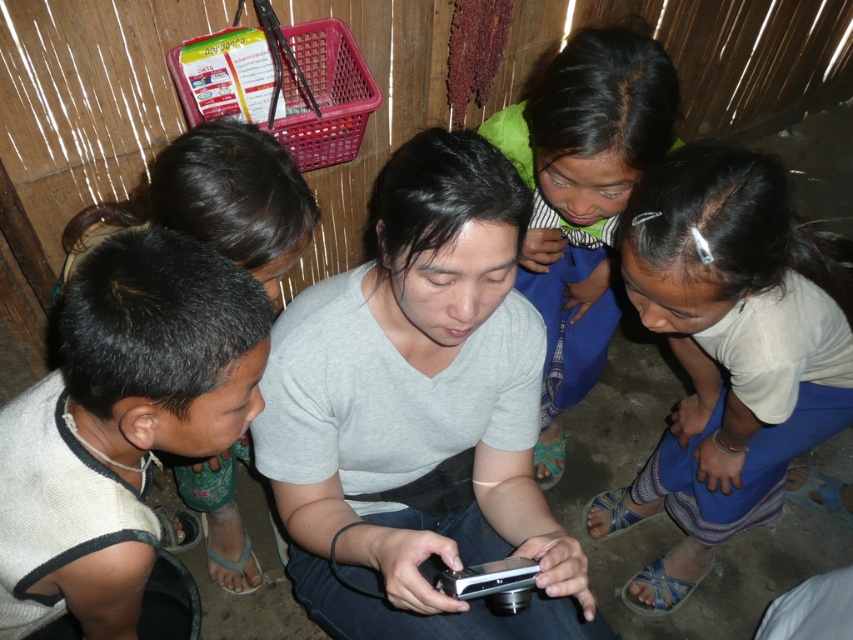
Between green fabric shirt at upper center and silver metallic smartphone at center, which one has less height?

With less height is silver metallic smartphone at center.

Is green fabric shirt at upper center bigger than silver metallic smartphone at center?

Yes.

Identify the location of green fabric shirt at upper center. (582, 198).

Does point (125, 209) come behind point (477, 595)?

Yes, it is.

The width and height of the screenshot is (853, 640). What do you see at coordinates (213, 202) in the screenshot?
I see `gray matte shirt at center` at bounding box center [213, 202].

Is point (253, 211) positioned after point (456, 577)?

Yes, point (253, 211) is farther from viewer.

Where is `gray matte shirt at center`? This screenshot has width=853, height=640. gray matte shirt at center is located at coordinates (213, 202).

Can you confirm if white fabric shirt at lower right is taller than silver metallic smartphone at center?

Yes, white fabric shirt at lower right is taller than silver metallic smartphone at center.

What do you see at coordinates (728, 352) in the screenshot? I see `white fabric shirt at lower right` at bounding box center [728, 352].

I want to click on white fabric shirt at lower right, so click(x=728, y=352).

Find the location of a particular element. The height and width of the screenshot is (640, 853). white fabric shirt at lower right is located at coordinates (728, 352).